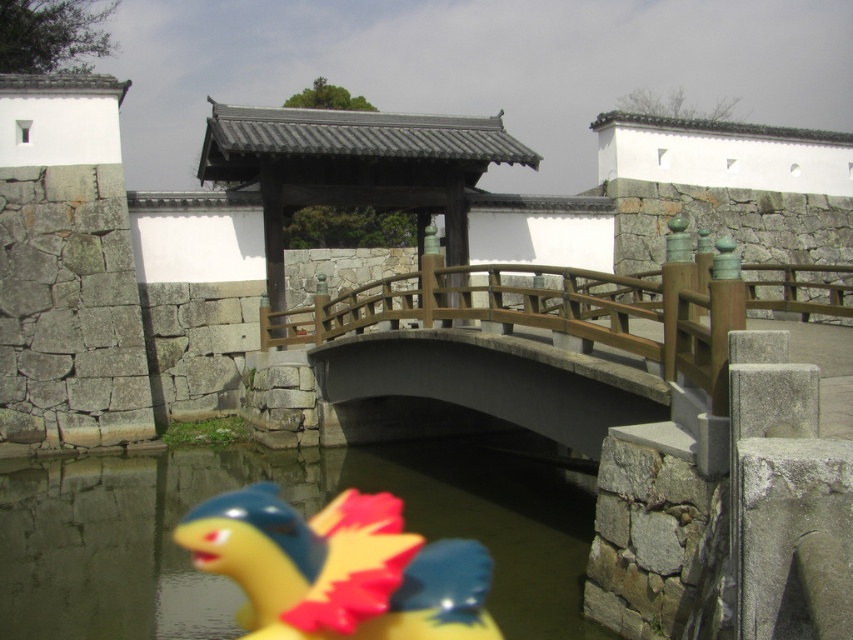
Who is shorter, transparent plastic water at lower center or yellow rubber duck at lower center?

yellow rubber duck at lower center is shorter.

Find the location of a particular element. This screenshot has width=853, height=640. transparent plastic water at lower center is located at coordinates (292, 506).

Find the location of `transparent plastic water at lower center`. transparent plastic water at lower center is located at coordinates (292, 506).

Can you confirm if wooden bridge at center is taller than brown wooden gazebo at center?

No.

Does point (708, 289) come in front of point (271, 192)?

Yes.

Locate an element on the screen. This screenshot has width=853, height=640. wooden bridge at center is located at coordinates [x=560, y=332].

Find the location of `wooden bridge at center`. wooden bridge at center is located at coordinates (560, 332).

Which of these two, transparent plastic water at lower center or brown wooden gazebo at center, stands taller?

Standing taller between the two is brown wooden gazebo at center.

Describe the element at coordinates (292, 506) in the screenshot. I see `transparent plastic water at lower center` at that location.

Identify the location of transparent plastic water at lower center. (292, 506).